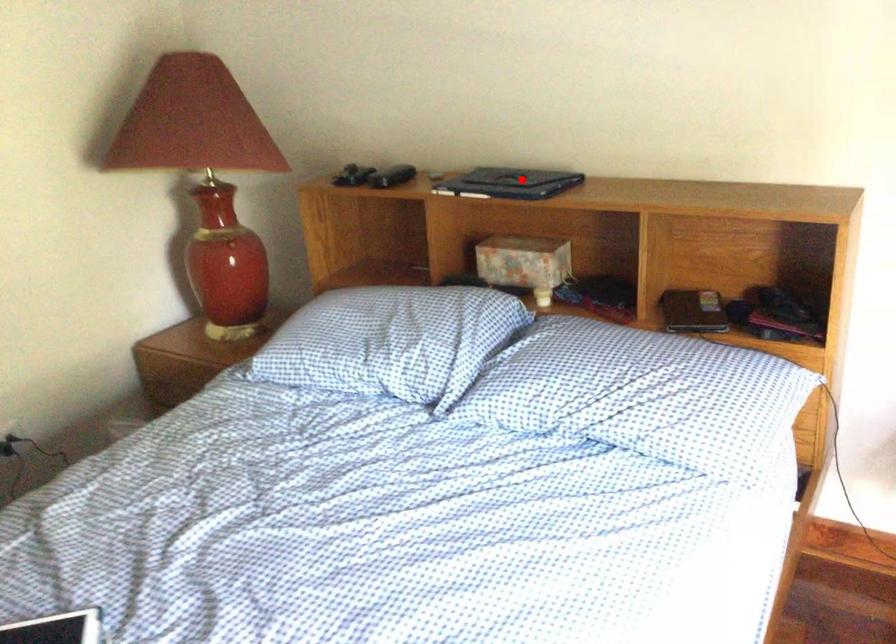
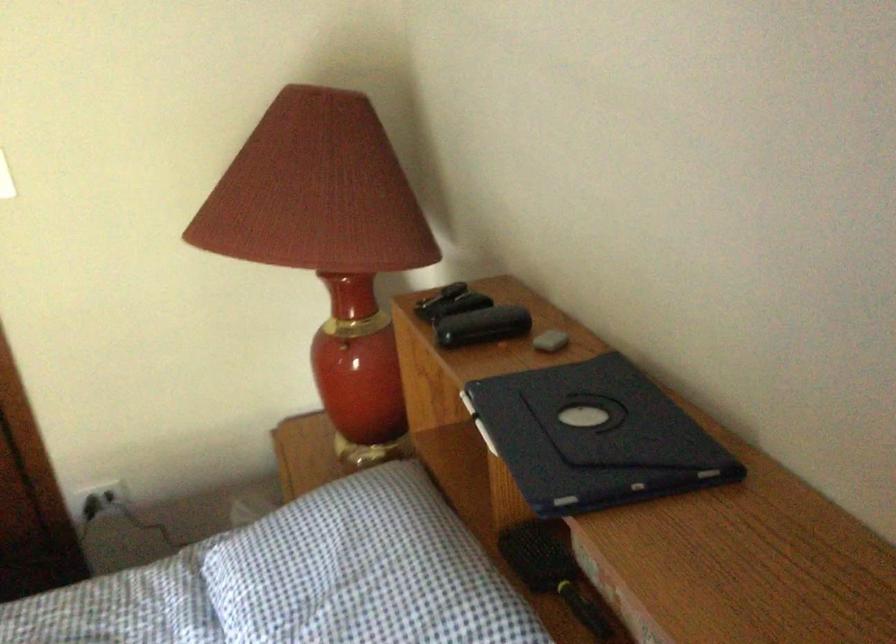
Locate, in the second image, the point that corresponds to the highlighted location in the first image.

(593, 437)